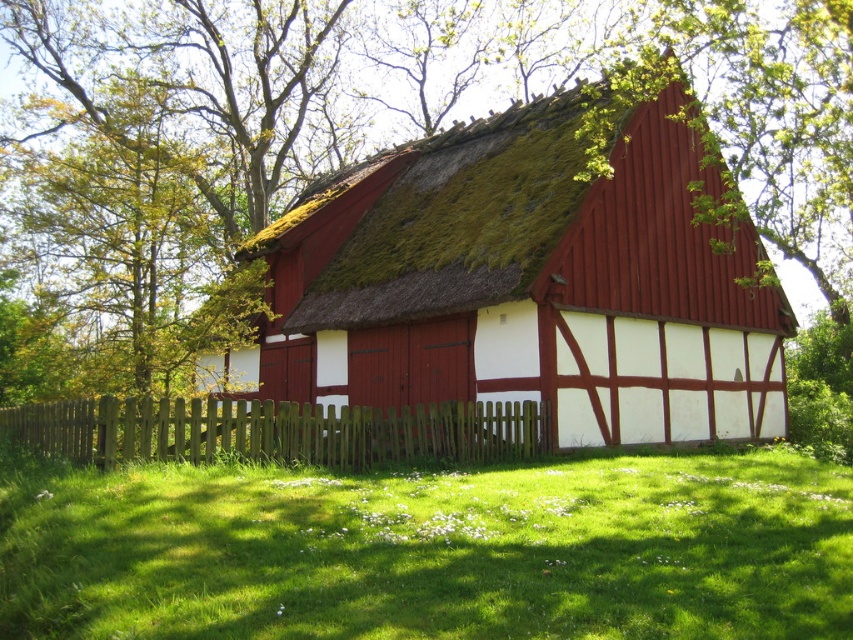
Looking at this image, does matte red wood hut at center have a larger size compared to brown wooden fence at lower center?

Yes.

Can you confirm if matte red wood hut at center is taller than brown wooden fence at lower center?

Yes.

Who is more forward, (677, 358) or (242, 429)?

Point (242, 429) is in front.

Identify the location of matte red wood hut at center. The image size is (853, 640). (529, 282).

Can you confirm if green grass at lower center is positioned below matte red wood hut at center?

Yes.

Can you confirm if green grass at lower center is wider than matte red wood hut at center?

Incorrect, green grass at lower center's width does not surpass matte red wood hut at center's.

Which is in front, point (802, 513) or point (494, 259)?

Point (802, 513)

I want to click on green grass at lower center, so click(428, 548).

Can you confirm if green grass at lower center is positioned to the right of brown wooden fence at lower center?

Yes, green grass at lower center is to the right of brown wooden fence at lower center.

Can you confirm if green grass at lower center is positioned above brown wooden fence at lower center?

No.

Is point (3, 458) behind point (354, 445)?

That is False.

At what (x,y) coordinates should I click in order to perform the action: click on green grass at lower center. Please return your answer as a coordinate pair (x, y). The image size is (853, 640). Looking at the image, I should click on (428, 548).